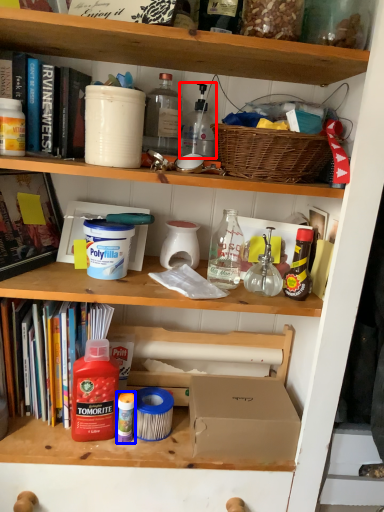
Question: Which object appears closest to the camera in this image, bottle (highlighted by a red box) or bottle (highlighted by a blue box)?

Choices:
 (A) bottle
 (B) bottle

Answer: (B)